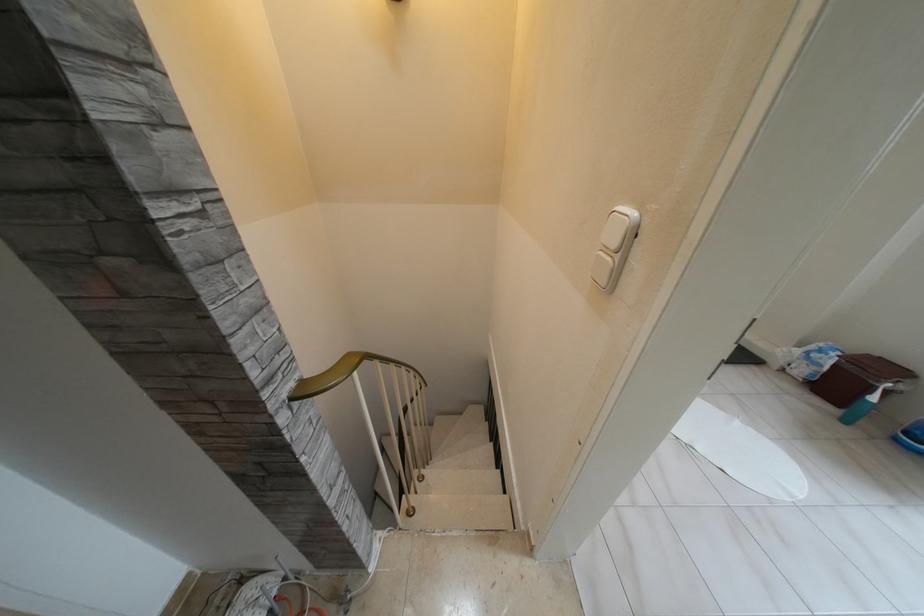
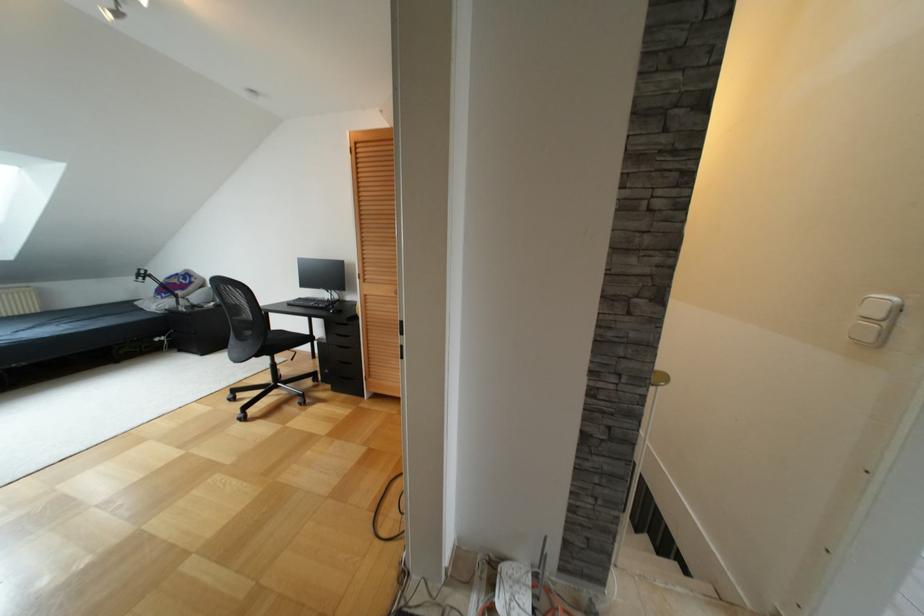
Which direction would the cameraman need to move to produce the second image?

The cameraman moved toward left, backward.